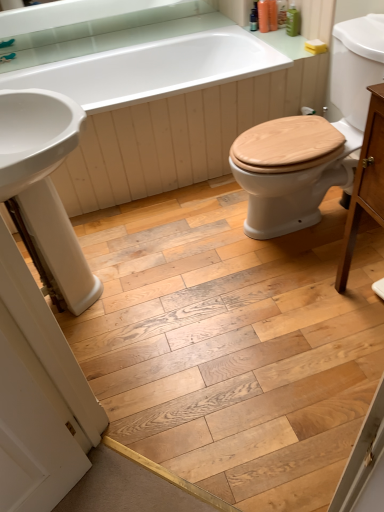
The image size is (384, 512). What are the coordinates of `white glossy sink at left` in the screenshot? It's located at (45, 184).

The width and height of the screenshot is (384, 512). I want to click on brushed metal faucet at upper left, so click(x=7, y=57).

This screenshot has height=512, width=384. Describe the element at coordinates (7, 57) in the screenshot. I see `brushed metal faucet at upper left` at that location.

Find the location of `white glossy bathtub at upper center`. white glossy bathtub at upper center is located at coordinates (185, 132).

The height and width of the screenshot is (512, 384). In order to click on white glossy sink at left in this screenshot , I will do `click(45, 184)`.

You are a GUI agent. You are given a task and a screenshot of the screen. Output one action in this format:
    pyautogui.click(x=<x>, y=<y>)
    Task: Click on the sink below the brushed metal faucet at upper left (from the image's perspective)
    The height and width of the screenshot is (512, 384).
    Given the screenshot: What is the action you would take?
    pyautogui.click(x=45, y=184)

From the image's perspective, is white glossy sink at left beneath brushed metal faucet at upper left?

Yes, from the image's perspective, white glossy sink at left is below brushed metal faucet at upper left.

From a real-world perspective, does white glossy sink at left sit lower than brushed metal faucet at upper left?

Yes, from a real-world perspective, white glossy sink at left is beneath brushed metal faucet at upper left.

Can you tell me how much white glossy sink at left and brushed metal faucet at upper left differ in facing direction?

The angle between the facing direction of white glossy sink at left and the facing direction of brushed metal faucet at upper left is 21.7 degrees.

Does brushed metal faucet at upper left lie in front of white glossy bathtub at upper center?

No, brushed metal faucet at upper left is further to the viewer.

Considering the relative sizes of brushed metal faucet at upper left and white glossy bathtub at upper center in the image provided, is brushed metal faucet at upper left shorter than white glossy bathtub at upper center?

Indeed, brushed metal faucet at upper left has a lesser height compared to white glossy bathtub at upper center.

Image resolution: width=384 pixels, height=512 pixels. I want to click on faucet above the white glossy bathtub at upper center (from a real-world perspective), so click(x=7, y=57).

From the image's perspective, does brushed metal faucet at upper left appear lower than white glossy bathtub at upper center?

Incorrect, from the image's perspective, brushed metal faucet at upper left is higher than white glossy bathtub at upper center.

Between point (7, 60) and point (304, 127), which one is positioned behind?

The point (7, 60) is farther from the camera.

Considering the sizes of objects brushed metal faucet at upper left and wooden at right in the image provided, who is wider, brushed metal faucet at upper left or wooden at right?

Wider between the two is wooden at right.

Considering the sizes of objects brushed metal faucet at upper left and wooden at right in the image provided, who is shorter, brushed metal faucet at upper left or wooden at right?

brushed metal faucet at upper left is shorter.

Considering the positions of objects brushed metal faucet at upper left and wooden at right in the image provided, who is in front, brushed metal faucet at upper left or wooden at right?

wooden at right.

Considering the relative positions of wooden at right and white glossy bathtub at upper center in the image provided, is wooden at right to the right of white glossy bathtub at upper center from the viewer's perspective?

Correct, you'll find wooden at right to the right of white glossy bathtub at upper center.

This screenshot has width=384, height=512. In the image, there is a wooden at right. Find the location of `bath below it (from a real-world perspective)`. bath below it (from a real-world perspective) is located at coordinates (185, 132).

Looking at their sizes, would you say wooden at right is wider or thinner than white glossy bathtub at upper center?

Clearly, wooden at right has less width compared to white glossy bathtub at upper center.

Is wooden at right not close to white glossy bathtub at upper center?

They are positioned close to each other.

Would you say white glossy sink at left is outside light brown wood cabinet at right?

Yes, white glossy sink at left is outside of light brown wood cabinet at right.

Are white glossy sink at left and light brown wood cabinet at right located far from each other?

white glossy sink at left is actually quite close to light brown wood cabinet at right.

From the image's perspective, which is above, white glossy sink at left or light brown wood cabinet at right?

white glossy sink at left is shown above in the image.

Image resolution: width=384 pixels, height=512 pixels. What are the coordinates of `sink lying above the light brown wood cabinet at right (from the image's perspective)` in the screenshot? It's located at pyautogui.click(x=45, y=184).

Who is taller, light brown wood cabinet at right or brushed metal faucet at upper left?

With more height is light brown wood cabinet at right.

Is light brown wood cabinet at right looking in the opposite direction of brushed metal faucet at upper left?

light brown wood cabinet at right is not turned away from brushed metal faucet at upper left.

Is point (367, 124) closer or farther from the camera than point (0, 60)?

Clearly, point (367, 124) is closer to the camera than point (0, 60).

The image size is (384, 512). Identify the location of faucet above the light brown wood cabinet at right (from the image's perspective). (7, 57).

Are white glossy bathtub at upper center and brushed metal faucet at upper left located far from each other?

No, white glossy bathtub at upper center is in close proximity to brushed metal faucet at upper left.

Can you confirm if white glossy bathtub at upper center is smaller than brushed metal faucet at upper left?

Actually, white glossy bathtub at upper center might be larger than brushed metal faucet at upper left.

Between white glossy bathtub at upper center and brushed metal faucet at upper left, which one has less height?

With less height is brushed metal faucet at upper left.

Find the location of `sink in front of the brushed metal faucet at upper left`. sink in front of the brushed metal faucet at upper left is located at coordinates (45, 184).

The image size is (384, 512). What are the coordinates of `faucet to the left of white glossy bathtub at upper center` in the screenshot? It's located at (7, 57).

Which object lies nearer to the anchor point wooden at right, white glossy bathtub at upper center or light brown wood cabinet at right?

light brown wood cabinet at right.

From the image, which object appears to be farther from light brown wood cabinet at right, brushed metal faucet at upper left or white glossy bathtub at upper center?

Based on the image, brushed metal faucet at upper left appears to be further to light brown wood cabinet at right.

Looking at the image, which one is located closer to light brown wood cabinet at right, white glossy sink at left or white glossy bathtub at upper center?

white glossy sink at left is positioned closer to the anchor light brown wood cabinet at right.

When comparing their distances from wooden at right, does brushed metal faucet at upper left or white glossy sink at left seem closer?

white glossy sink at left.

When comparing their distances from brushed metal faucet at upper left, does wooden at right or white glossy sink at left seem closer?

white glossy sink at left.

Estimate the real-world distances between objects in this image. Which object is further from white glossy sink at left, white glossy bathtub at upper center or wooden at right?

wooden at right is positioned further to the anchor white glossy sink at left.

When comparing their distances from white glossy bathtub at upper center, does light brown wood cabinet at right or white glossy sink at left seem closer?

white glossy sink at left.

Looking at the image, which one is located closer to white glossy bathtub at upper center, brushed metal faucet at upper left or light brown wood cabinet at right?

brushed metal faucet at upper left is closer to white glossy bathtub at upper center.

Identify the location of bath between white glossy sink at left and brushed metal faucet at upper left in the front-back direction. (185, 132).

You are a GUI agent. You are given a task and a screenshot of the screen. Output one action in this format:
    pyautogui.click(x=<x>, y=<y>)
    Task: Click on the sit between brushed metal faucet at upper left and light brown wood cabinet at right in the horizontal direction
    This screenshot has width=384, height=512.
    Given the screenshot: What is the action you would take?
    pyautogui.click(x=310, y=141)

You are a GUI agent. You are given a task and a screenshot of the screen. Output one action in this format:
    pyautogui.click(x=<x>, y=<y>)
    Task: Click on the sit between light brown wood cabinet at right and white glossy bathtub at upper center from front to back
    
    Given the screenshot: What is the action you would take?
    [x=310, y=141]

Find the location of a particular element. bath between white glossy sink at left and wooden at right is located at coordinates (185, 132).